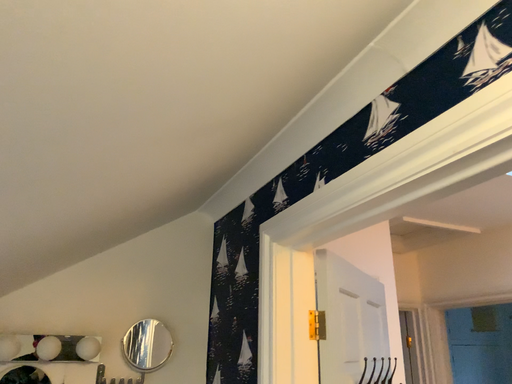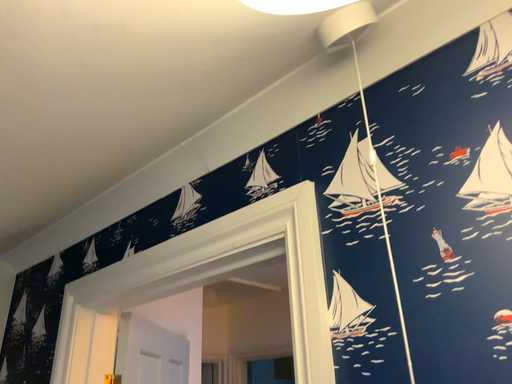
Question: Which way did the camera rotate in the video?

Choices:
 (A) rotated left
 (B) rotated right

Answer: (B)